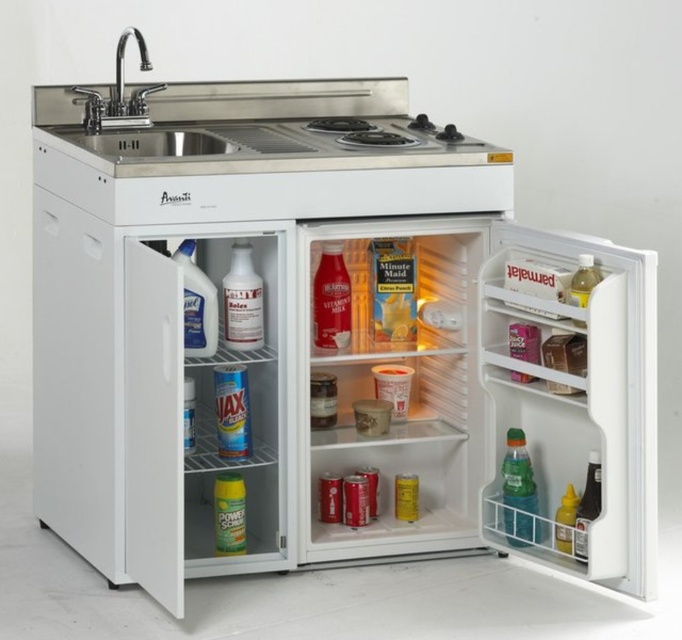
You are a kitchen assistant who needs to place a new clear plastic bottle at left into the refrigerator. However, there is already a stainless steel sink at upper left above it. Can you safely place the new bottle in the refrigerator without moving the sink?

The stainless steel sink at upper left is positioned over the clear plastic bottle at left, meaning the sink is above the refrigerator shelf where the bottle is located. Since the sink is part of the kitchen unit and cannot be moved, you cannot place the new bottle there without displacing the sink, which is fixed in place.

You are organizing the kitchenette and need to place the clear plastic bottle at left into the stainless steel sink at upper left. Is there enough space to fit the bottle inside the sink?

The stainless steel sink at upper left is bigger than the clear plastic bottle at left, so yes, the bottle can fit inside the sink.